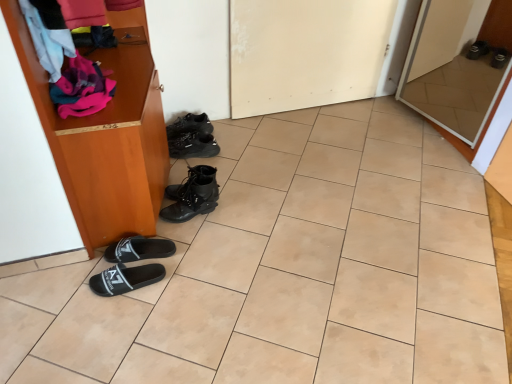
Where is `unoccupied region to the right of black fabric slipper at lower left, the 4th footwear from the top`? The image size is (512, 384). unoccupied region to the right of black fabric slipper at lower left, the 4th footwear from the top is located at coordinates (194, 256).